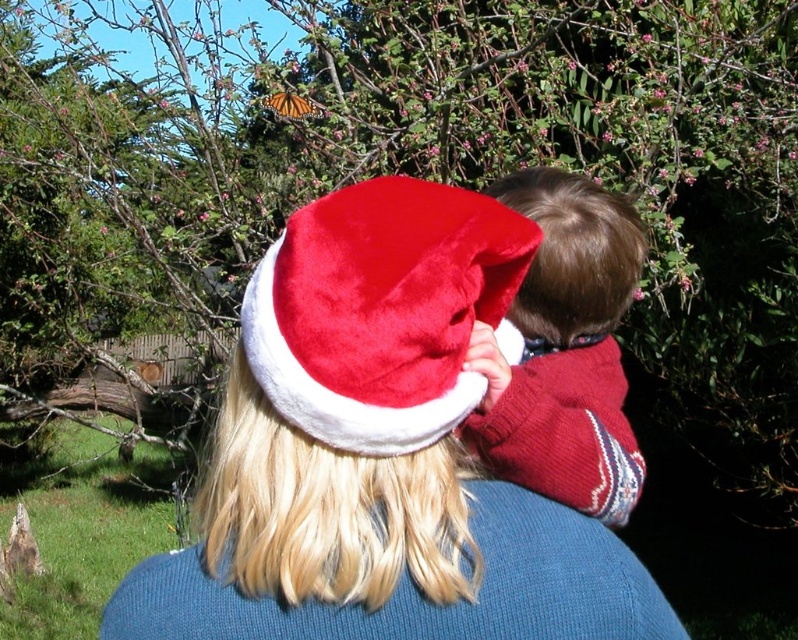
You are a delivery drone that needs to drop off a package to the recipient standing near the velvet santa hat at center. The drone has a minimum safe distance of 7 feet to avoid hitting the orange translucent butterfly at upper center. Can you safely deliver the package?

The velvet santa hat at center is 6.52 feet from the orange translucent butterfly at upper center. Since the drone requires a minimum safe distance of 7 feet, the distance is insufficient. The drone cannot safely deliver the package without risking collision with the orange translucent butterfly at upper center.

You are a photographer trying to capture both the velvet red santa hat at center and the orange translucent butterfly at upper center in a single frame. Based on their sizes, which object should you focus on first to ensure both fit in the photo?

The velvet red santa hat at center might be wider than orange translucent butterfly at upper center, so focusing on the velvet red santa hat at center first would help ensure both fit in the photo.

You are a photographer trying to capture a clear photo of the orange translucent butterfly at upper center. However, the velvet red santa hat at center is blocking your view. Can you move the hat to get a clear shot of the butterfly?

The velvet red santa hat at center is closer to the viewer than the orange translucent butterfly at upper center, so moving the hat would allow you to see the butterfly clearly.